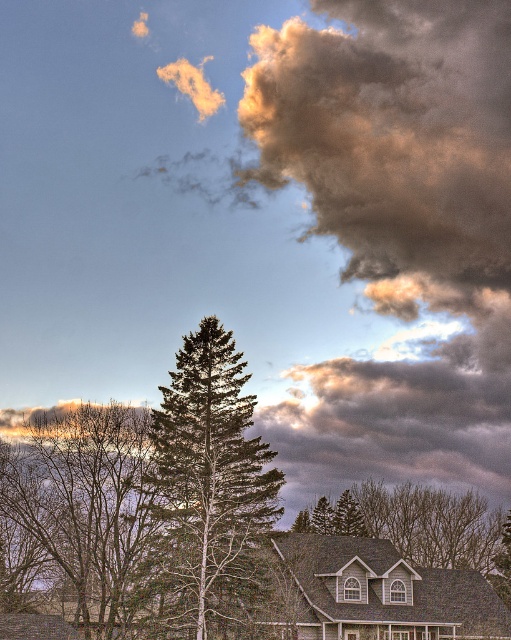
You are an astronomer observing the sky and need to locate a specific point for your telescope. The coordinates given are point (396, 144). Based on the scene description, where exactly is this point located?

The point (396, 144) is located on the cloudy textured sky at upper right.

You are an artist painting this scene and want to add a mountain behind the green matte evergreen tree at center. Can you place it behind the cloudy textured sky at upper right?

The cloudy textured sky at upper right is closer to the viewer than the green matte evergreen tree at center, so you cannot place a mountain behind the cloudy textured sky at upper right because it would be in front of the tree.